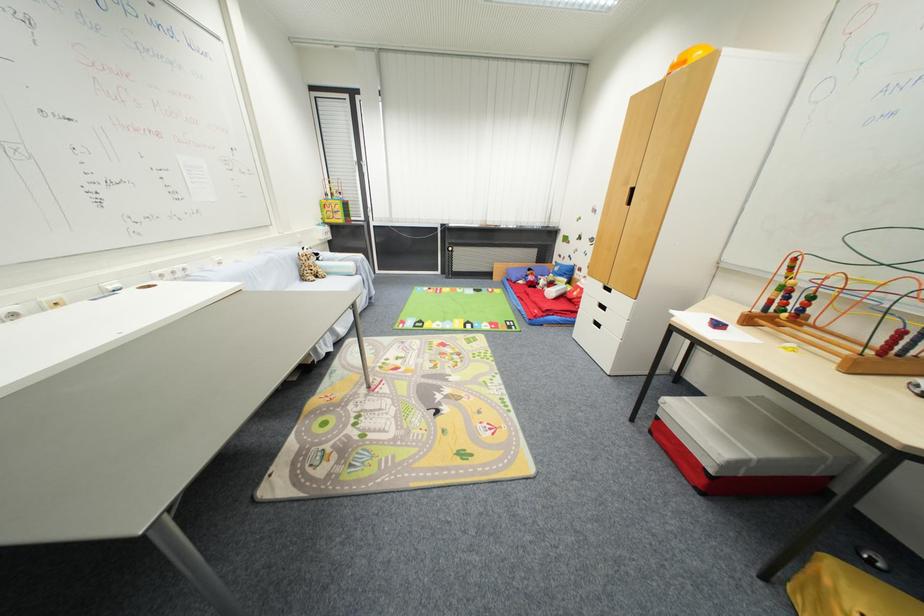
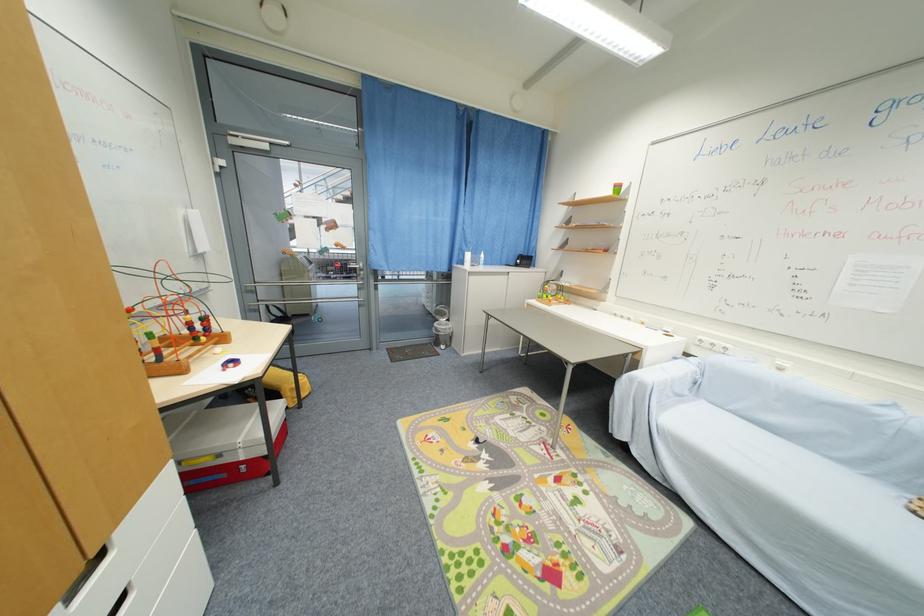
Locate, in the second image, the point that corresponds to (x=225, y=265) in the first image.

(785, 371)